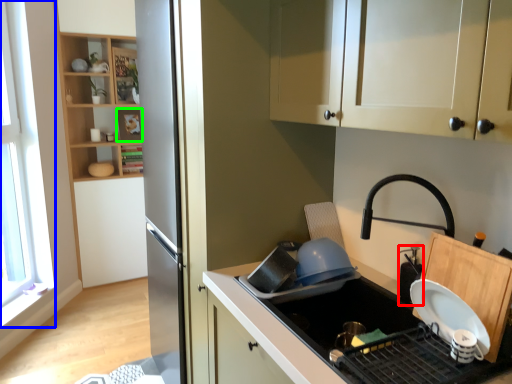
Question: Considering the real-world distances, which object is closest to appliance (highlighted by a red box)? window (highlighted by a blue box) or shelf (highlighted by a green box).

Choices:
 (A) window
 (B) shelf

Answer: (A)